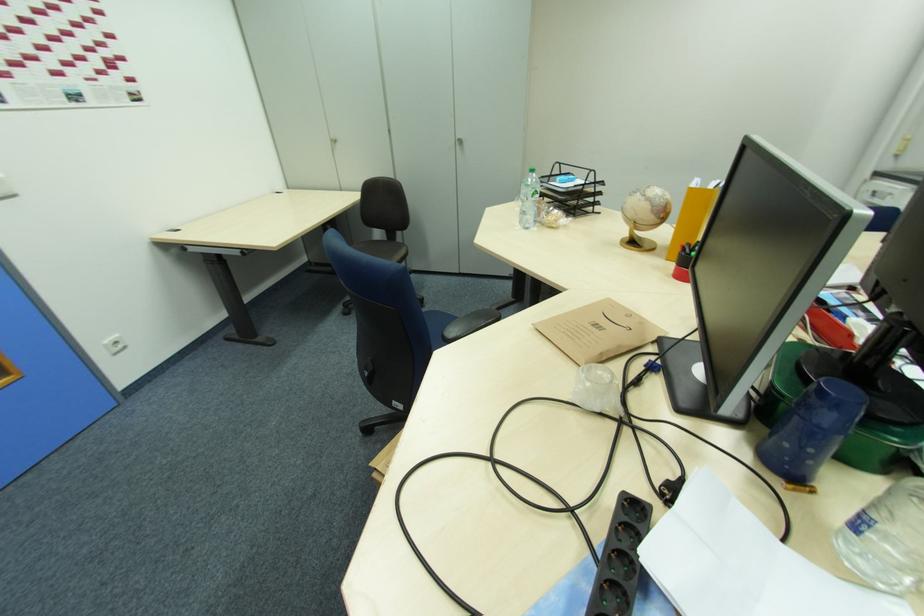
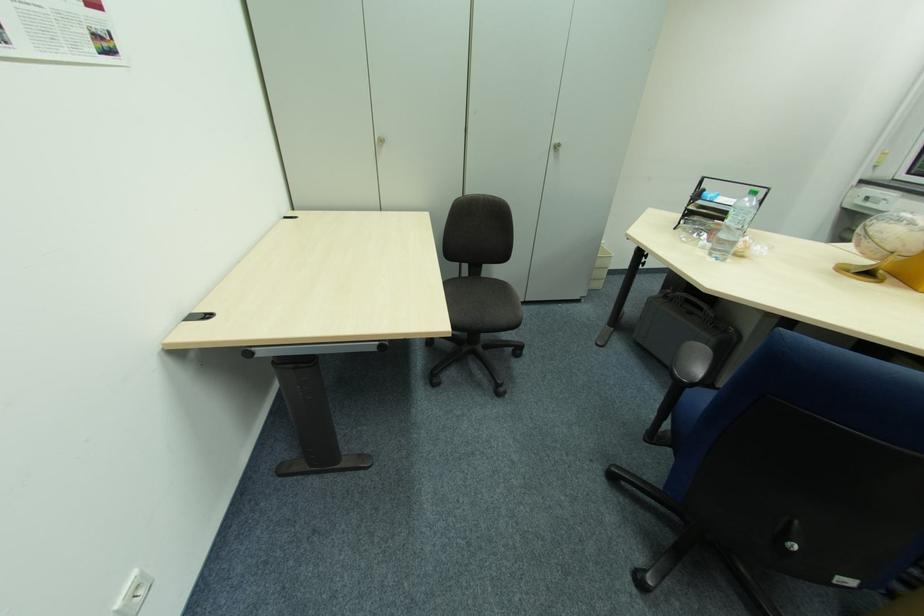
The point at (529, 197) is marked in the first image. Where is the corresponding point in the second image?

(743, 224)